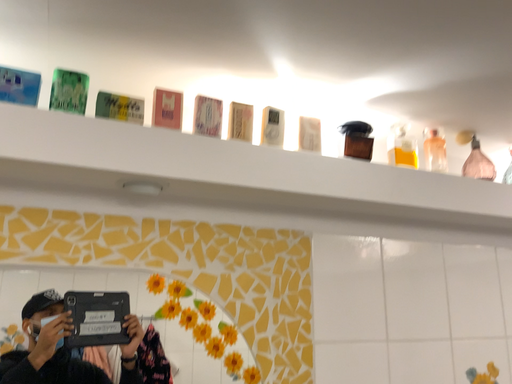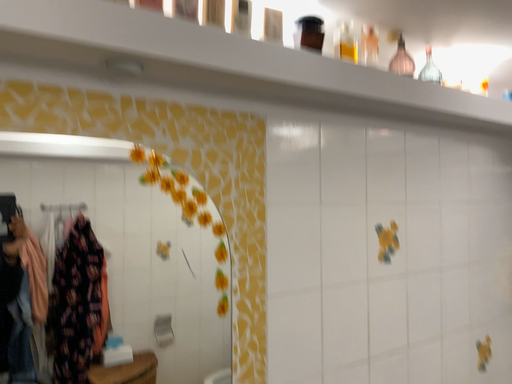
Question: How did the camera likely rotate when shooting the video?

Choices:
 (A) rotated left
 (B) rotated right

Answer: (B)